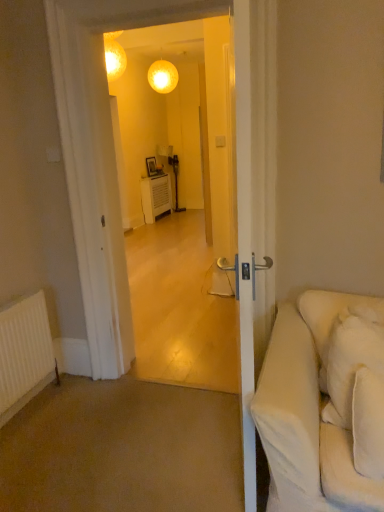
Question: Is white soft pillow at right looking in the opposite direction of white matte radiator at lower left?

Choices:
 (A) yes
 (B) no

Answer: (B)

Question: Is the surface of white soft pillow at right in direct contact with white matte radiator at lower left?

Choices:
 (A) yes
 (B) no

Answer: (B)

Question: Is white soft pillow at right surrounding white matte radiator at lower left?

Choices:
 (A) no
 (B) yes

Answer: (A)

Question: Is white soft pillow at right smaller than white matte radiator at lower left?

Choices:
 (A) no
 (B) yes

Answer: (A)

Question: Considering the relative sizes of white soft pillow at right and white matte radiator at lower left in the image provided, is white soft pillow at right shorter than white matte radiator at lower left?

Choices:
 (A) no
 (B) yes

Answer: (B)

Question: From a real-world perspective, is white soft pillow at right beneath white matte radiator at lower left?

Choices:
 (A) no
 (B) yes

Answer: (A)

Question: Is white soft pillow at right bigger than transparent glass door at center?

Choices:
 (A) yes
 (B) no

Answer: (B)

Question: From the image's perspective, is white soft pillow at right located above transparent glass door at center?

Choices:
 (A) yes
 (B) no

Answer: (B)

Question: Is white soft pillow at right positioned with its back to transparent glass door at center?

Choices:
 (A) no
 (B) yes

Answer: (A)

Question: From a real-world perspective, is white soft pillow at right below transparent glass door at center?

Choices:
 (A) yes
 (B) no

Answer: (A)

Question: Is white soft pillow at right aimed at transparent glass door at center?

Choices:
 (A) no
 (B) yes

Answer: (A)

Question: Is white soft pillow at right wider than transparent glass door at center?

Choices:
 (A) yes
 (B) no

Answer: (B)

Question: Is white soft pillow at right at the back of transparent glass door at center?

Choices:
 (A) yes
 (B) no

Answer: (B)